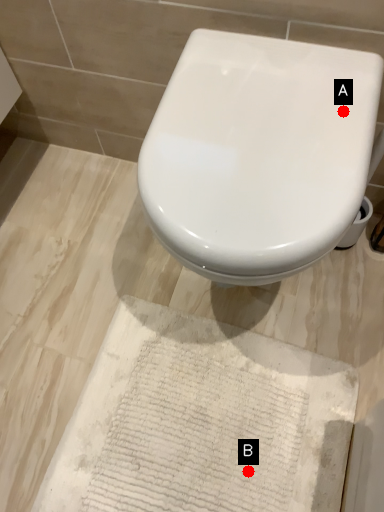
Question: Two points are circled on the image, labeled by A and B beside each circle. Which point is closer to the camera taking this photo?

Choices:
 (A) A is closer
 (B) B is closer

Answer: (A)